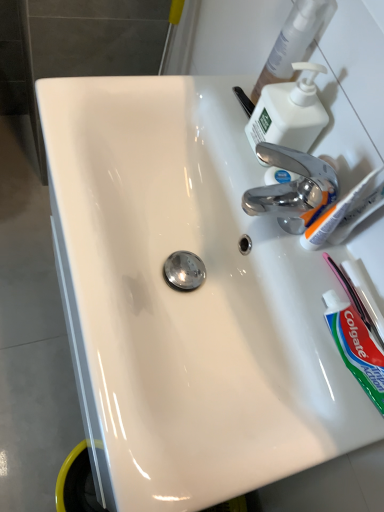
You are a GUI agent. You are given a task and a screenshot of the screen. Output one action in this format:
    pyautogui.click(x=<x>, y=<y>)
    Task: Click on the vacant area that is in front of white plastic soap dispenser at upper right
    This screenshot has width=384, height=512.
    Given the screenshot: What is the action you would take?
    pyautogui.click(x=270, y=219)